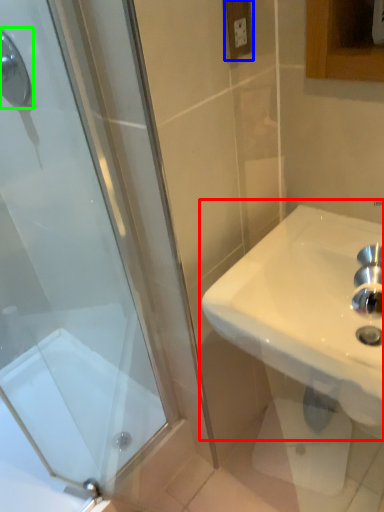
Question: Based on their relative distances, which object is nearer to sink (highlighted by a red box)? Choose from electric outlet (highlighted by a blue box) and shower (highlighted by a green box).

Choices:
 (A) electric outlet
 (B) shower

Answer: (A)